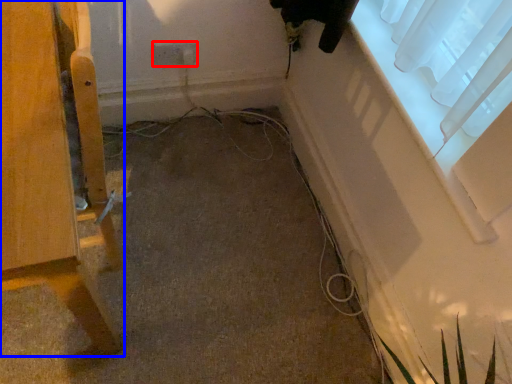
Question: Which object is further to the camera taking this photo, electric outlet (highlighted by a red box) or furniture (highlighted by a blue box)?

Choices:
 (A) electric outlet
 (B) furniture

Answer: (A)